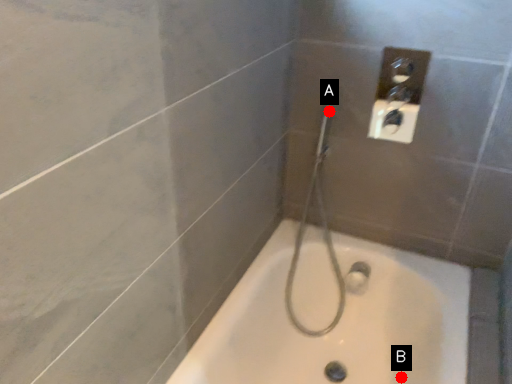
Question: Two points are circled on the image, labeled by A and B beside each circle. Which point is farther to the camera?

Choices:
 (A) A is further
 (B) B is further

Answer: (A)